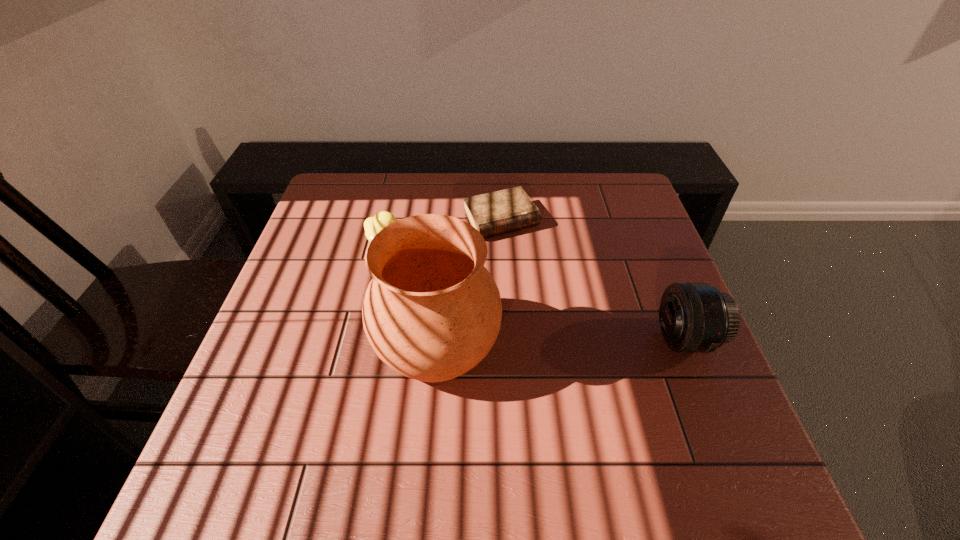
Where is `vacant space at the left edge of the desktop`? Image resolution: width=960 pixels, height=540 pixels. vacant space at the left edge of the desktop is located at coordinates (282, 301).

Locate an element on the screen. The width and height of the screenshot is (960, 540). free location at the right edge of the desktop is located at coordinates (636, 356).

In the image, there is a desktop. Identify the location of free region at the near left corner. (281, 428).

This screenshot has height=540, width=960. Identify the location of empty location between the telephoto lens and the shortest object. (593, 279).

Locate an element on the screen. The height and width of the screenshot is (540, 960). free space that is in between the third shortest object and the pottery is located at coordinates (562, 342).

Select which object is the third closest to the pottery. Please provide its 2D coordinates. Your answer should be formatted as a tuple, i.e. [(x, y)], where the tuple contains the x and y coordinates of a point satisfying the conditions above.

[(694, 317)]

At what (x,y) coordinates should I click in order to perform the action: click on object that is the second closest to the tallest object. Please return your answer as a coordinate pair (x, y). Looking at the image, I should click on (494, 213).

Where is `vacant space that satisfies the following two spatial constraints: 1. on the back side of the pottery; 2. on the right side of the diary`? vacant space that satisfies the following two spatial constraints: 1. on the back side of the pottery; 2. on the right side of the diary is located at coordinates (447, 220).